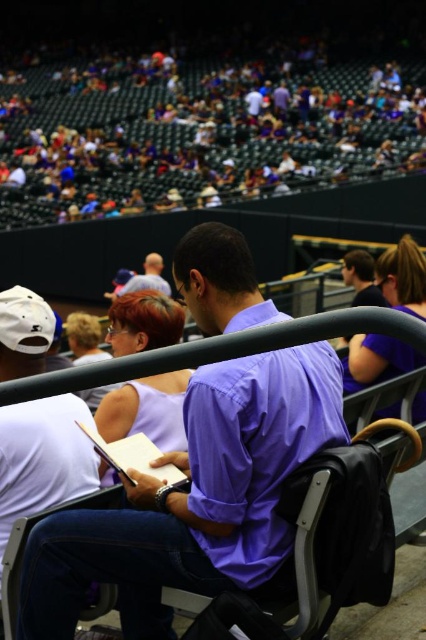
Question: In this image, where is white matte baseball cap at left located relative to purple fabric shirt at upper right?

Choices:
 (A) right
 (B) left

Answer: (B)

Question: Which of the following is the farthest from the observer?

Choices:
 (A) light blue shirt at center
 (B) black plastic chair at center
 (C) matte purple shirt at center

Answer: (C)

Question: Is white matte baseball cap at left bigger than black plastic chair at center?

Choices:
 (A) no
 (B) yes

Answer: (B)

Question: Which point appears farthest from the camera in this image?

Choices:
 (A) (11, 586)
 (B) (365, 362)

Answer: (B)

Question: Can you confirm if white matte baseball cap at left is smaller than black plastic chair at center?

Choices:
 (A) yes
 (B) no

Answer: (B)

Question: Which point appears closest to the camera in this image?

Choices:
 (A) (313, 404)
 (B) (112, 602)
 (C) (357, 369)
 (D) (149, 253)

Answer: (A)